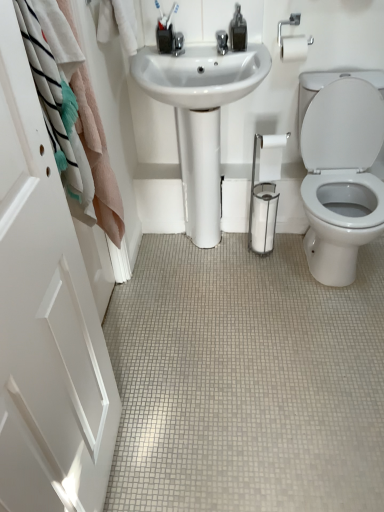
Question: Can you confirm if white glossy door at left is positioned to the left of white tile floor at center?

Choices:
 (A) yes
 (B) no

Answer: (A)

Question: Can you confirm if white glossy door at left is smaller than white tile floor at center?

Choices:
 (A) no
 (B) yes

Answer: (B)

Question: Does white glossy door at left have a greater width compared to white tile floor at center?

Choices:
 (A) yes
 (B) no

Answer: (B)

Question: Can we say white glossy door at left lies outside white tile floor at center?

Choices:
 (A) yes
 (B) no

Answer: (A)

Question: Is white glossy door at left beside white tile floor at center?

Choices:
 (A) no
 (B) yes

Answer: (A)

Question: Considering the positions of white glossy door at left and white tile floor at center in the image, is white glossy door at left taller or shorter than white tile floor at center?

Choices:
 (A) tall
 (B) short

Answer: (A)

Question: From the image's perspective, is white glossy door at left above or below white tile floor at center?

Choices:
 (A) above
 (B) below

Answer: (A)

Question: Do you think white glossy door at left is within white tile floor at center, or outside of it?

Choices:
 (A) inside
 (B) outside

Answer: (B)

Question: Does point (4, 342) appear closer or farther from the camera than point (144, 304)?

Choices:
 (A) closer
 (B) farther

Answer: (A)

Question: Does point click(8, 108) appear closer or farther from the camera than point click(187, 138)?

Choices:
 (A) farther
 (B) closer

Answer: (B)

Question: From a real-world perspective, is white glossy door at left physically located above or below white glossy sink at center?

Choices:
 (A) above
 (B) below

Answer: (A)

Question: Considering the positions of white glossy door at left and white glossy sink at center in the image, is white glossy door at left bigger or smaller than white glossy sink at center?

Choices:
 (A) small
 (B) big

Answer: (A)

Question: In the image, is white glossy door at left on the left side or the right side of white glossy sink at center?

Choices:
 (A) right
 (B) left

Answer: (B)

Question: Based on their positions, is white matte toilet paper at center located to the left or right of white tile floor at center?

Choices:
 (A) left
 (B) right

Answer: (B)

Question: From a real-world perspective, is white matte toilet paper at center physically located above or below white tile floor at center?

Choices:
 (A) above
 (B) below

Answer: (A)